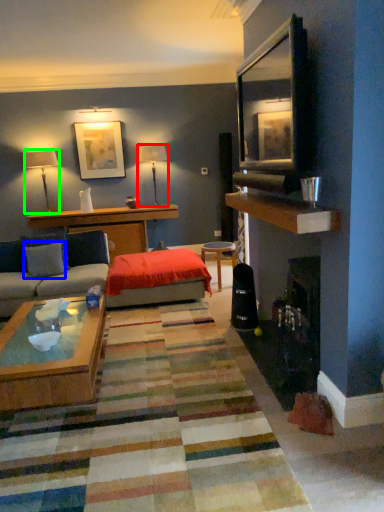
Question: Estimate the real-world distances between objects in this image. Which object is closer to lamp (highlighted by a red box), pillow (highlighted by a blue box) or lamp (highlighted by a green box)?

Choices:
 (A) pillow
 (B) lamp

Answer: (B)